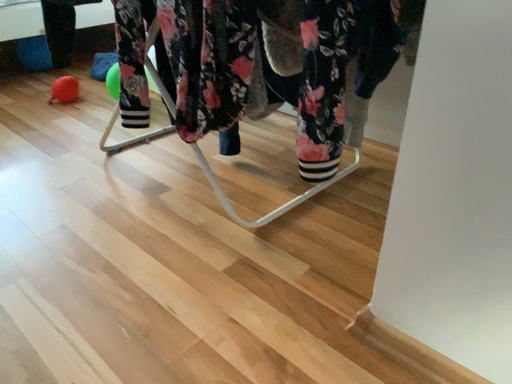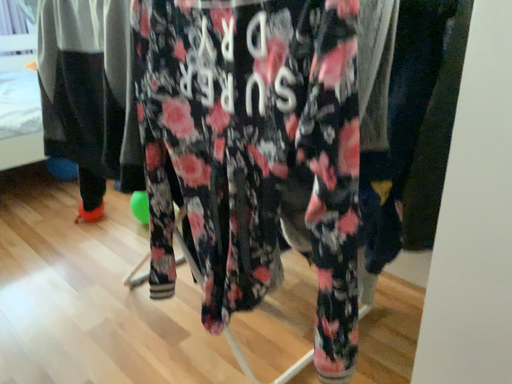
Question: How did the camera likely rotate when shooting the video?

Choices:
 (A) rotated upward
 (B) rotated downward

Answer: (A)